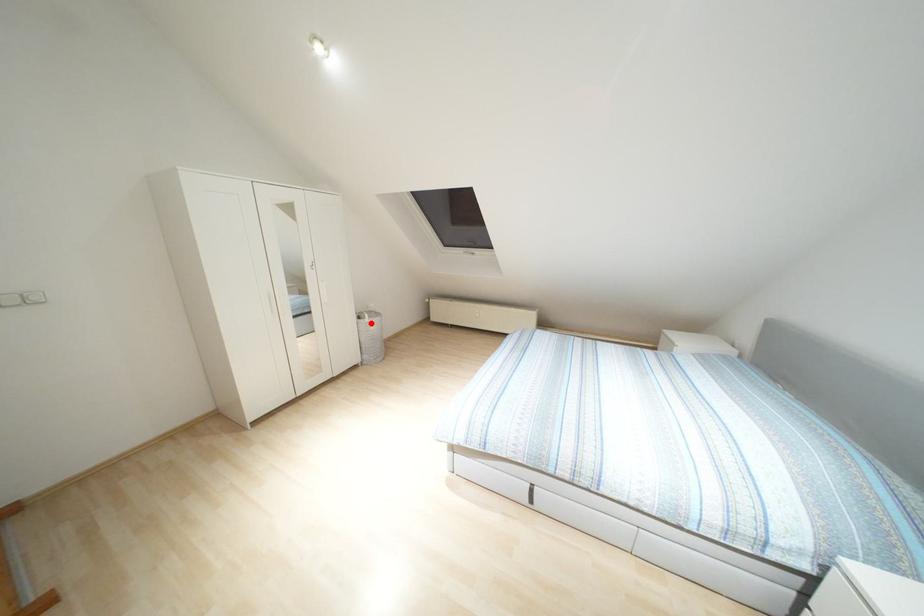
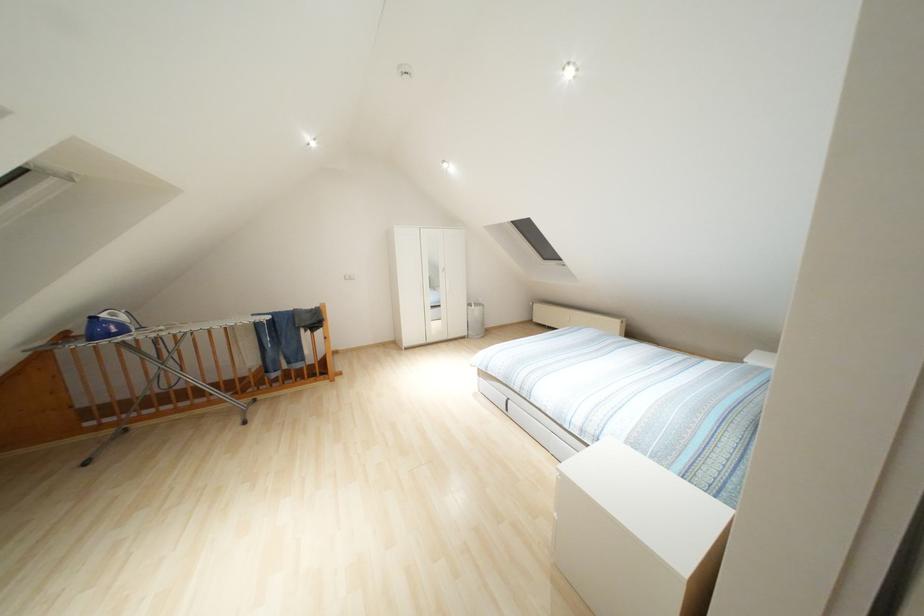
Question: I am providing you with two images of the same scene from different viewpoints. In image1, a red point is highlighted. Considering the same 3D point in image2, which of the following is correct?

Choices:
 (A) It is closer
 (B) It is farther

Answer: (B)